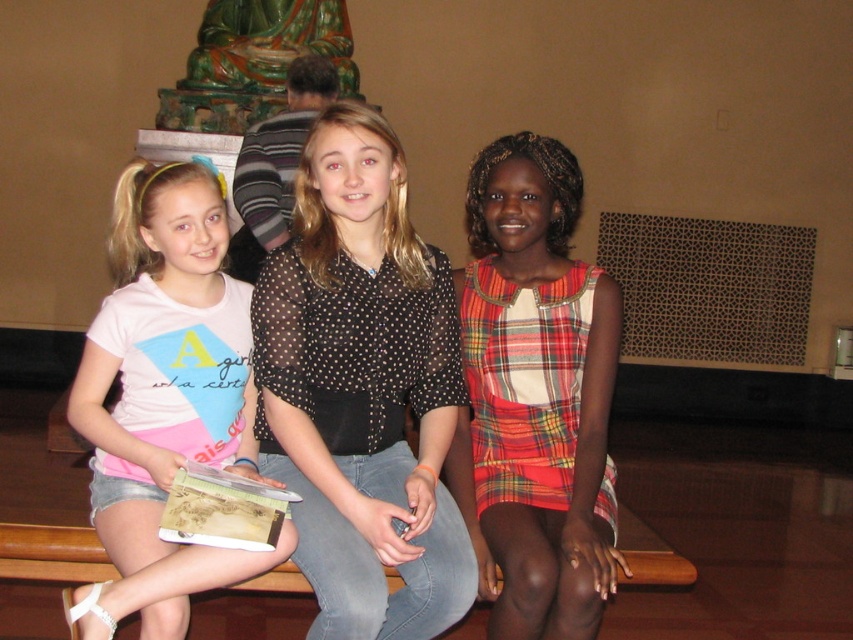
Does plaid fabric dress at right appear on the right side of pink cotton t-shirt at left?

Correct, you'll find plaid fabric dress at right to the right of pink cotton t-shirt at left.

Between plaid fabric dress at right and pink cotton t-shirt at left, which one appears on the right side from the viewer's perspective?

From the viewer's perspective, plaid fabric dress at right appears more on the right side.

Which is in front, point (543, 547) or point (233, 435)?

Point (543, 547) is in front.

Locate an element on the screen. plaid fabric dress at right is located at coordinates (535, 396).

Is point (374, 465) positioned behind point (577, 552)?

Yes, it is.

Who is taller, black sheer blouse at center or plaid fabric dress at right?

Standing taller between the two is black sheer blouse at center.

Is point (341, 419) farther from camera compared to point (608, 385)?

That is True.

Where is `black sheer blouse at center`? This screenshot has height=640, width=853. black sheer blouse at center is located at coordinates (363, 388).

Does black sheer blouse at center appear over pink cotton t-shirt at left?

Correct, black sheer blouse at center is located above pink cotton t-shirt at left.

Where is `black sheer blouse at center`? black sheer blouse at center is located at coordinates (363, 388).

Where is `black sheer blouse at center`? black sheer blouse at center is located at coordinates (363, 388).